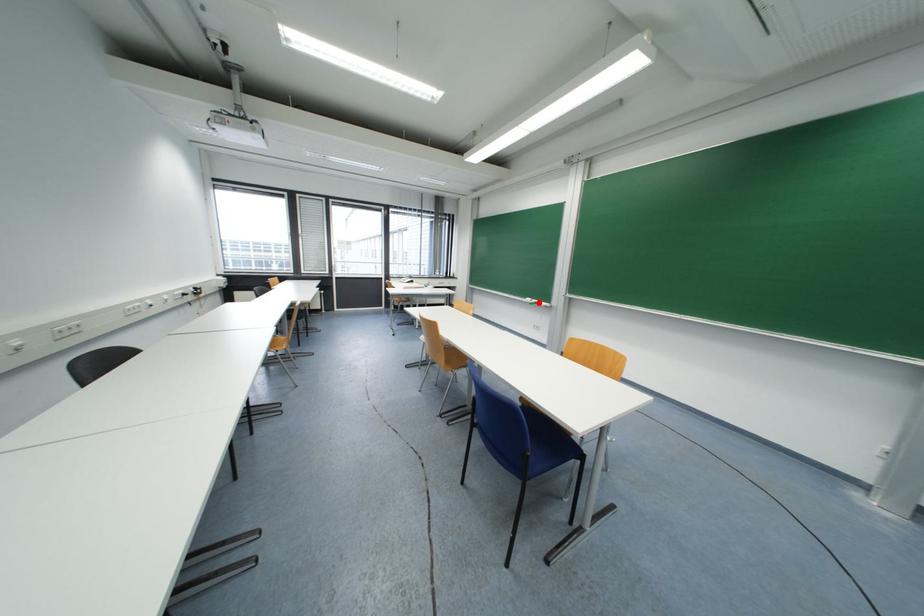
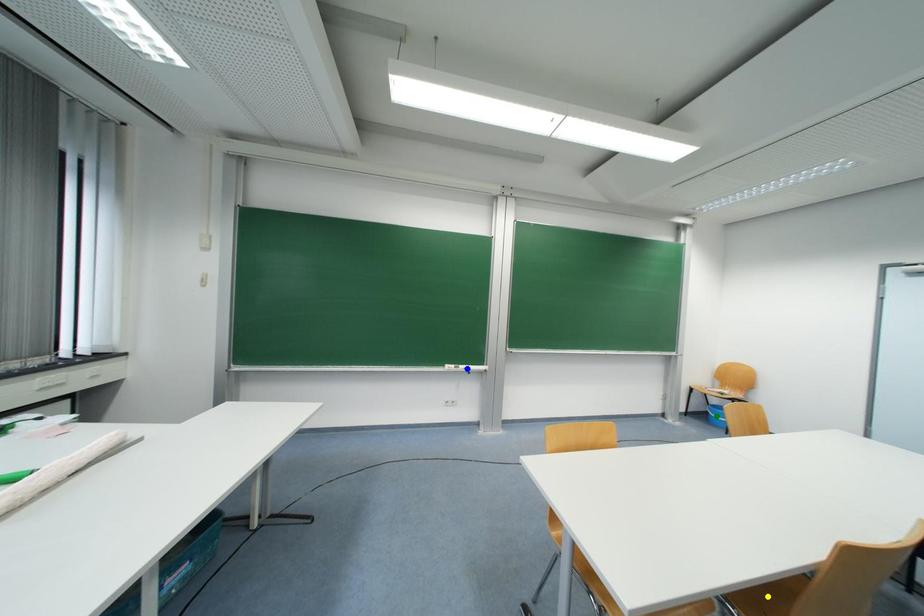
Question: I am providing you with two images of the same scene from different viewpoints. A red point is marked on the first image. You are given multiple points on the second image. Which mark in image 2 goes with the point in image 1?

Choices:
 (A) blue point
 (B) yellow point
 (C) green point

Answer: (A)